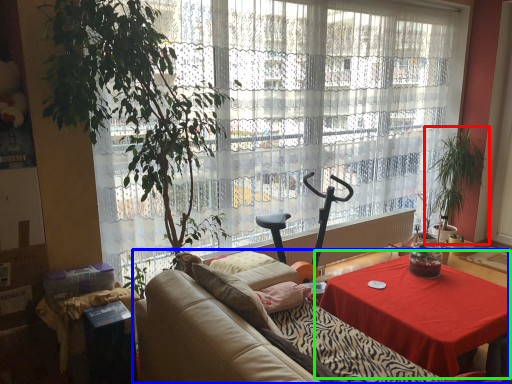
Question: Which object is positioned farthest from houseplant (highlighted by a red box)? Select from studio couch (highlighted by a blue box) and table (highlighted by a green box).

Choices:
 (A) studio couch
 (B) table

Answer: (A)